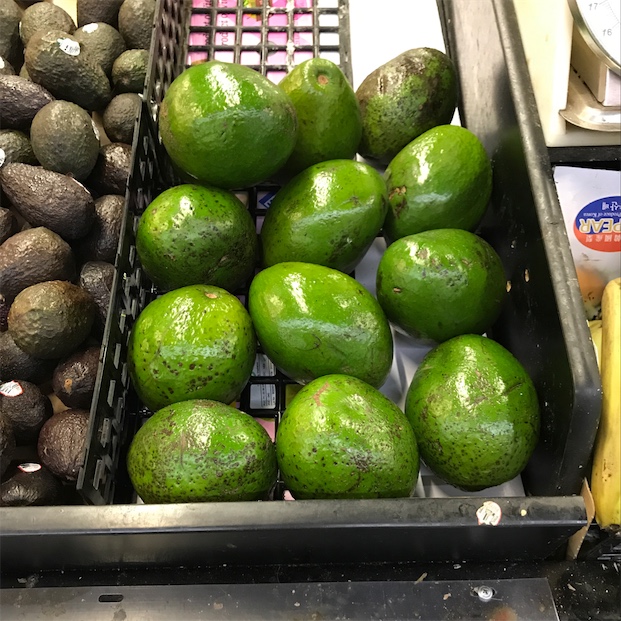
You are a GUI agent. You are given a task and a screenshot of the screen. Output one action in this format:
    pyautogui.click(x=<x>, y=<y>)
    Task: Click on the divider
    
    Given the screenshot: What is the action you would take?
    pyautogui.click(x=122, y=282)